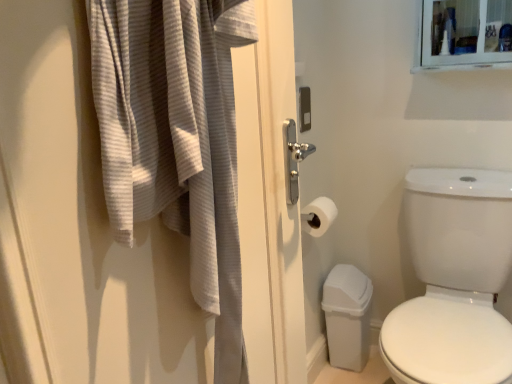
Question: From a real-world perspective, is white matte toilet paper at center on white glossy toilet at right?

Choices:
 (A) yes
 (B) no

Answer: (A)

Question: Could you tell me if white matte toilet paper at center is turned towards white glossy toilet at right?

Choices:
 (A) yes
 (B) no

Answer: (A)

Question: Can you confirm if white matte toilet paper at center is positioned to the left of white glossy toilet at right?

Choices:
 (A) yes
 (B) no

Answer: (A)

Question: Is white matte toilet paper at center bigger than white glossy toilet at right?

Choices:
 (A) yes
 (B) no

Answer: (B)

Question: Is white glossy toilet at right a part of white matte toilet paper at center?

Choices:
 (A) yes
 (B) no

Answer: (B)

Question: Is white matte toilet paper at center closer to the viewer compared to white glossy toilet at right?

Choices:
 (A) yes
 (B) no

Answer: (B)

Question: Does white matte toilet paper at center have a greater width compared to gray textured bath towel at left?

Choices:
 (A) no
 (B) yes

Answer: (A)

Question: Is white matte toilet paper at center outside of gray textured bath towel at left?

Choices:
 (A) yes
 (B) no

Answer: (A)

Question: Is white matte toilet paper at center oriented towards gray textured bath towel at left?

Choices:
 (A) yes
 (B) no

Answer: (B)

Question: Is gray textured bath towel at left a part of white matte toilet paper at center?

Choices:
 (A) yes
 (B) no

Answer: (B)

Question: Is the position of white matte toilet paper at center more distant than that of gray textured bath towel at left?

Choices:
 (A) yes
 (B) no

Answer: (A)

Question: From the image's perspective, is white matte toilet paper at center over gray textured bath towel at left?

Choices:
 (A) yes
 (B) no

Answer: (B)

Question: Can you confirm if white glossy toilet at right is wider than white matte toilet paper at center?

Choices:
 (A) yes
 (B) no

Answer: (A)